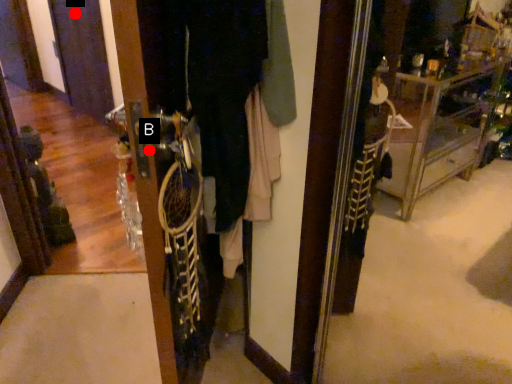
Question: Two points are circled on the image, labeled by A and B beside each circle. Which point is closer to the camera taking this photo?

Choices:
 (A) A is closer
 (B) B is closer

Answer: (B)